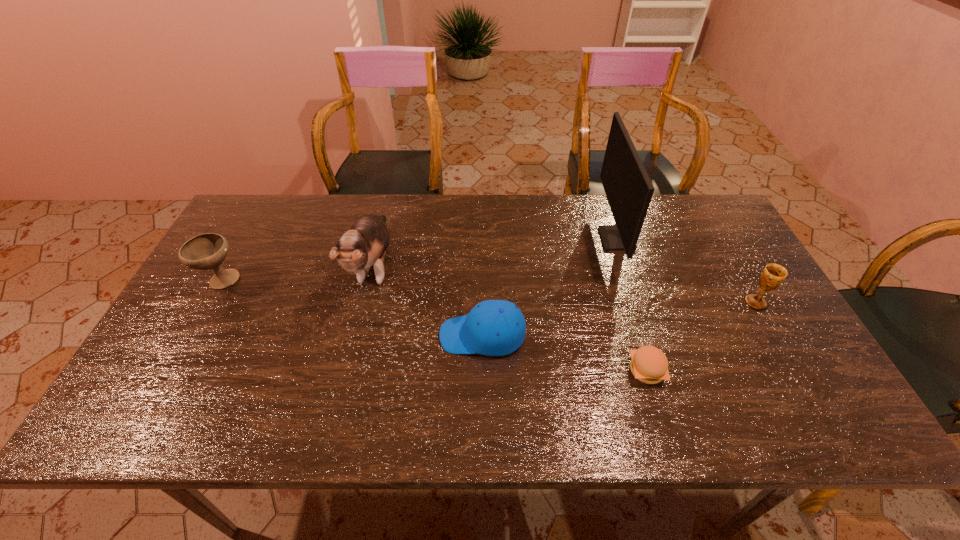
Locate an element on the screen. The width and height of the screenshot is (960, 540). blank area located 0.140m on the front-facing side of the tallest object is located at coordinates (x=556, y=239).

This screenshot has width=960, height=540. Identify the location of free space located at the face of the cat. (350, 364).

Locate an element on the screen. The height and width of the screenshot is (540, 960). vacant space located on the back of the left chalice is located at coordinates [266, 201].

I want to click on vacant position located 0.160m on the left of the rightmost object, so click(x=686, y=302).

At what (x,y) coordinates should I click in order to perform the action: click on vacant space located on the front-facing side of the fourth object from right to left. Please return your answer as a coordinate pair (x, y). Looking at the image, I should click on click(x=404, y=335).

Find the location of a particular element. The height and width of the screenshot is (540, 960). vacant region located on the front-facing side of the fourth object from right to left is located at coordinates (297, 335).

You are a GUI agent. You are given a task and a screenshot of the screen. Output one action in this format:
    pyautogui.click(x=<x>, y=<y>)
    Task: Click on the vacant area situated 0.170m on the front-facing side of the fourth object from right to left
    This screenshot has height=540, width=960.
    Given the screenshot: What is the action you would take?
    pyautogui.click(x=372, y=335)

Identify the location of vacant point located 0.200m on the right of the shortest object. (749, 371).

At what (x,y) coordinates should I click in order to perform the action: click on computer monitor that is at the far edge. Please return your answer as a coordinate pair (x, y). This screenshot has height=540, width=960. Looking at the image, I should click on (628, 188).

Locate an element on the screen. cat present at the far edge is located at coordinates (365, 244).